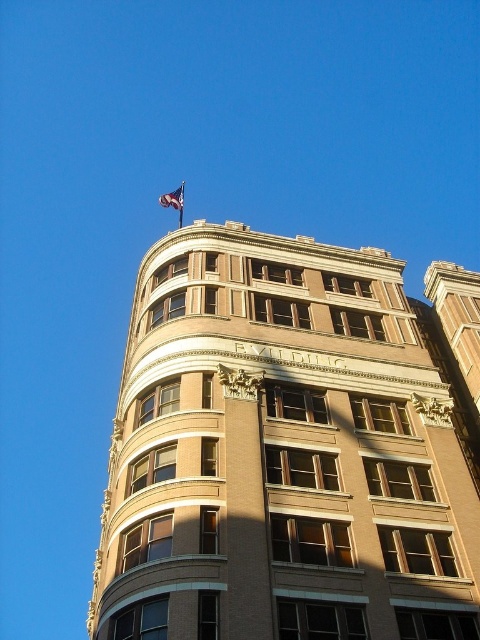
Does brown brick building at upper center have a lesser width compared to metallic flag pole at upper center?

In fact, brown brick building at upper center might be wider than metallic flag pole at upper center.

Which of these two, brown brick building at upper center or metallic flag pole at upper center, stands taller?

Standing taller between the two is brown brick building at upper center.

Who is more forward, (383, 410) or (180, 186)?

Point (383, 410) is more forward.

What are the coordinates of `brown brick building at upper center` in the screenshot? It's located at (291, 445).

Who is positioned more to the right, brown brick building at upper center or blue fabric flag at upper center?

Positioned to the right is brown brick building at upper center.

This screenshot has width=480, height=640. What do you see at coordinates (291, 445) in the screenshot? I see `brown brick building at upper center` at bounding box center [291, 445].

Identify the location of brown brick building at upper center. (291, 445).

Between blue fabric flag at upper center and metallic flag pole at upper center, which one has less height?

With less height is blue fabric flag at upper center.

Can you confirm if blue fabric flag at upper center is positioned to the right of metallic flag pole at upper center?

Incorrect, blue fabric flag at upper center is not on the right side of metallic flag pole at upper center.

Who is more distant from viewer, [181,188] or [181,204]?

Positioned behind is point [181,188].

The width and height of the screenshot is (480, 640). I want to click on blue fabric flag at upper center, so click(x=172, y=198).